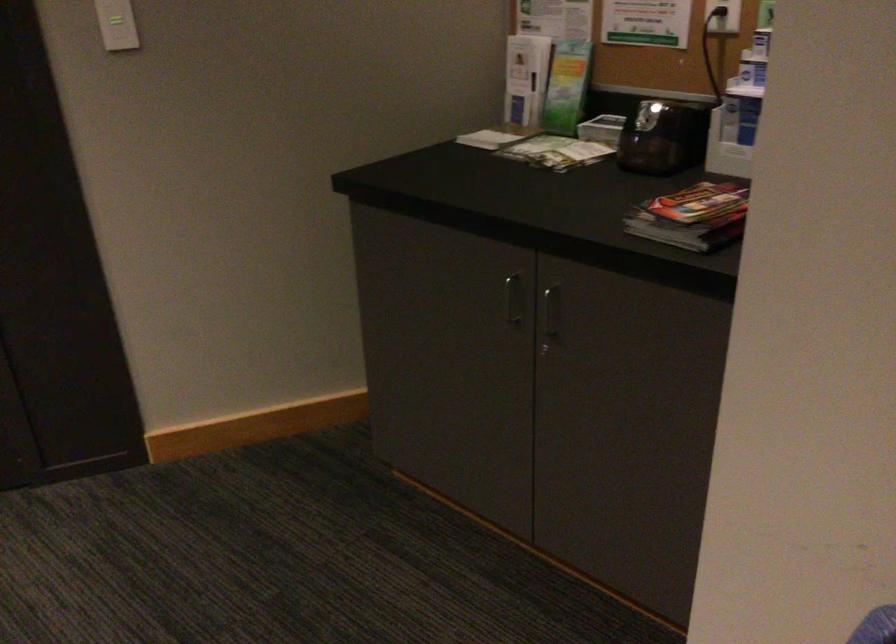
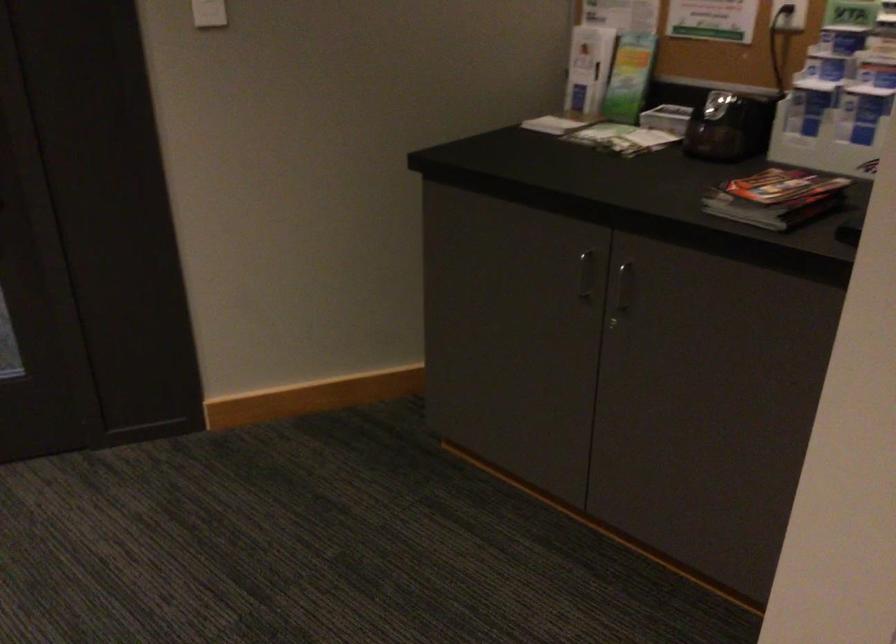
Where in the second image is the point corresponding to (x=513, y=298) from the first image?

(584, 275)